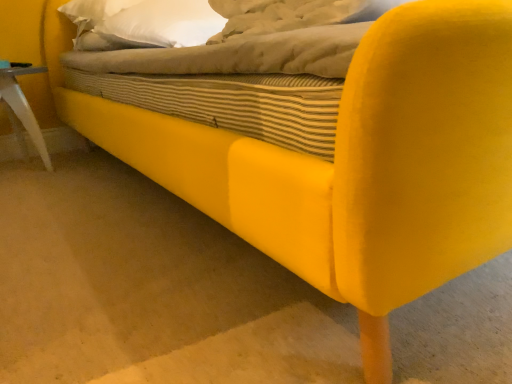
Question: Should I look upward or downward to see white soft pillow at upper center?

Choices:
 (A) down
 (B) up

Answer: (B)

Question: Considering the relative sizes of white plastic side table at lower left and white soft pillow at upper center in the image provided, is white plastic side table at lower left taller than white soft pillow at upper center?

Choices:
 (A) yes
 (B) no

Answer: (A)

Question: Can you confirm if white plastic side table at lower left is positioned to the right of white soft pillow at upper center?

Choices:
 (A) yes
 (B) no

Answer: (B)

Question: Is white plastic side table at lower left oriented away from white soft pillow at upper center?

Choices:
 (A) no
 (B) yes

Answer: (A)

Question: Is white plastic side table at lower left positioned behind white soft pillow at upper center?

Choices:
 (A) yes
 (B) no

Answer: (A)

Question: Is white plastic side table at lower left located outside white soft pillow at upper center?

Choices:
 (A) yes
 (B) no

Answer: (A)

Question: Is white plastic side table at lower left aimed at white soft pillow at upper center?

Choices:
 (A) yes
 (B) no

Answer: (B)

Question: From the image's perspective, is white soft pillow at upper center on white plastic side table at lower left?

Choices:
 (A) yes
 (B) no

Answer: (A)

Question: Is white soft pillow at upper center shorter than white plastic side table at lower left?

Choices:
 (A) no
 (B) yes

Answer: (B)

Question: Considering the relative positions of white soft pillow at upper center and white plastic side table at lower left in the image provided, is white soft pillow at upper center behind white plastic side table at lower left?

Choices:
 (A) no
 (B) yes

Answer: (A)

Question: Could you tell me if white soft pillow at upper center is facing white plastic side table at lower left?

Choices:
 (A) no
 (B) yes

Answer: (A)

Question: Can you see white soft pillow at upper center touching white plastic side table at lower left?

Choices:
 (A) no
 (B) yes

Answer: (A)

Question: Is white soft pillow at upper center bigger than white plastic side table at lower left?

Choices:
 (A) no
 (B) yes

Answer: (B)

Question: Is point (22, 145) positioned closer to the camera than point (130, 16)?

Choices:
 (A) farther
 (B) closer

Answer: (A)